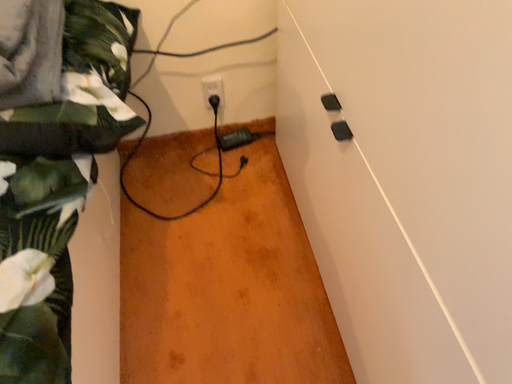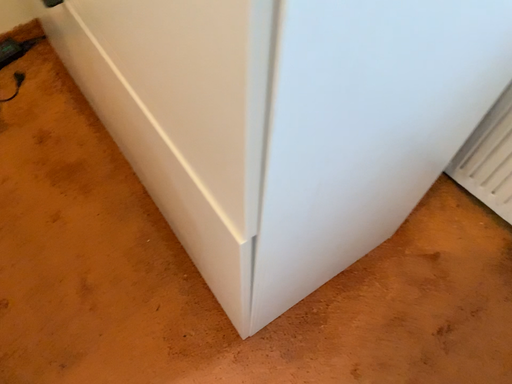
Question: Which way did the camera rotate in the video?

Choices:
 (A) rotated upward
 (B) rotated downward

Answer: (B)